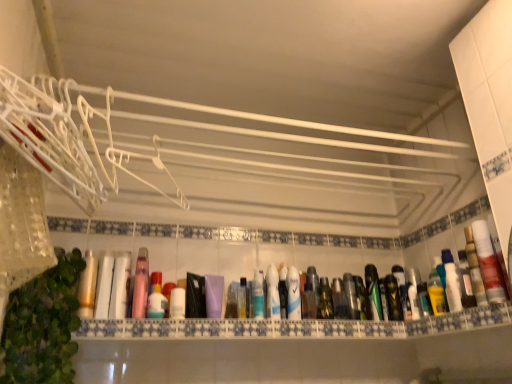
Question: Can green leafy plant at lower left be found inside metallic silver spray can at center?

Choices:
 (A) yes
 (B) no

Answer: (B)

Question: Can you confirm if metallic silver spray can at center is positioned to the right of green leafy plant at lower left?

Choices:
 (A) yes
 (B) no

Answer: (A)

Question: Are metallic silver spray can at center and green leafy plant at lower left located far from each other?

Choices:
 (A) yes
 (B) no

Answer: (A)

Question: Considering the relative sizes of metallic silver spray can at center and green leafy plant at lower left in the image provided, is metallic silver spray can at center shorter than green leafy plant at lower left?

Choices:
 (A) yes
 (B) no

Answer: (A)

Question: Is metallic silver spray can at center wider than green leafy plant at lower left?

Choices:
 (A) no
 (B) yes

Answer: (A)

Question: Choose the correct answer: Is green leafy plant at lower left inside white plastic bottle at right, the first mouthwash in the right-to-left sequence, or outside it?

Choices:
 (A) inside
 (B) outside

Answer: (B)

Question: Based on their sizes in the image, would you say green leafy plant at lower left is bigger or smaller than white plastic bottle at right, the first mouthwash in the right-to-left sequence?

Choices:
 (A) big
 (B) small

Answer: (A)

Question: Looking at their shapes, would you say green leafy plant at lower left is wider or thinner than white plastic bottle at right, the first mouthwash in the right-to-left sequence?

Choices:
 (A) wide
 (B) thin

Answer: (A)

Question: Considering the relative positions of green leafy plant at lower left and white plastic bottle at right, positioned as the 8th mouthwash in left-to-right order, in the image provided, is green leafy plant at lower left to the left or to the right of white plastic bottle at right, positioned as the 8th mouthwash in left-to-right order,?

Choices:
 (A) right
 (B) left

Answer: (B)

Question: From the image's perspective, relative to white plastic bottle at right, the first mouthwash in the right-to-left sequence, is translucent plastic mouthwash at center, the 6th mouthwash when ordered from left to right, above or below?

Choices:
 (A) above
 (B) below

Answer: (B)

Question: Based on their positions, is translucent plastic mouthwash at center, the 6th mouthwash when ordered from left to right, located to the left or right of white plastic bottle at right, the first mouthwash in the right-to-left sequence?

Choices:
 (A) left
 (B) right

Answer: (A)

Question: Is translucent plastic mouthwash at center, marked as the third mouthwash in a right-to-left arrangement, inside or outside of white plastic bottle at right, the first mouthwash in the right-to-left sequence?

Choices:
 (A) inside
 (B) outside

Answer: (B)

Question: Does point pos(313,266) appear closer or farther from the camera than point pos(480,253)?

Choices:
 (A) closer
 (B) farther

Answer: (B)

Question: In terms of size, does green matte bottle at center, which appears as the 7th mouthwash when viewed from the left, appear bigger or smaller than green leafy plant at lower left?

Choices:
 (A) big
 (B) small

Answer: (B)

Question: Is green matte bottle at center, which appears as the 7th mouthwash when viewed from the left, taller or shorter than green leafy plant at lower left?

Choices:
 (A) short
 (B) tall

Answer: (A)